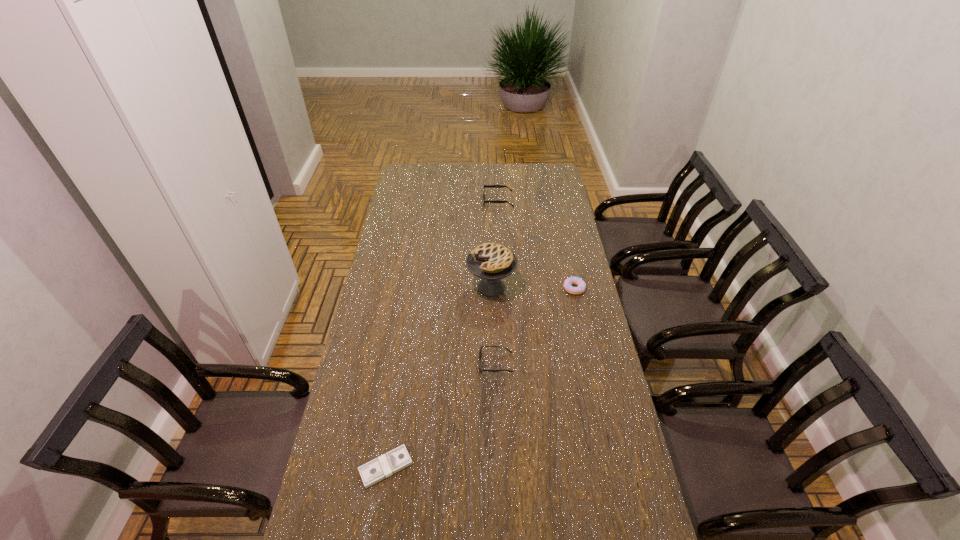
The image size is (960, 540). In order to click on vacant area that lies between the shorter sunglasses and the tallest object in this screenshot , I will do `click(493, 325)`.

Where is `free space between the farther sunglasses and the nearest object`? free space between the farther sunglasses and the nearest object is located at coordinates (442, 334).

Identify the location of free spot between the pie and the rightmost object. (533, 288).

Find the location of a particular element. The width and height of the screenshot is (960, 540). the closest object to the doughnut is located at coordinates (491, 262).

Where is `the third closest object to the shortest object`? the third closest object to the shortest object is located at coordinates (569, 281).

The height and width of the screenshot is (540, 960). I want to click on free space that satisfies the following two spatial constraints: 1. at the front lenses of the farthest object; 2. on the front side of the leftmost object, so click(x=513, y=467).

Where is `vacant area in the image that satisfies the following two spatial constraints: 1. on the cut side of the tallest object; 2. on the right side of the rightmost object`? The image size is (960, 540). vacant area in the image that satisfies the following two spatial constraints: 1. on the cut side of the tallest object; 2. on the right side of the rightmost object is located at coordinates (492, 288).

Identify the location of vacant space that satisfies the following two spatial constraints: 1. on the cut side of the tallest object; 2. on the front side of the leftmost object. (496, 467).

The height and width of the screenshot is (540, 960). Identify the location of vacant space that satisfies the following two spatial constraints: 1. on the back side of the doughnut; 2. on the right side of the shortest object. (414, 288).